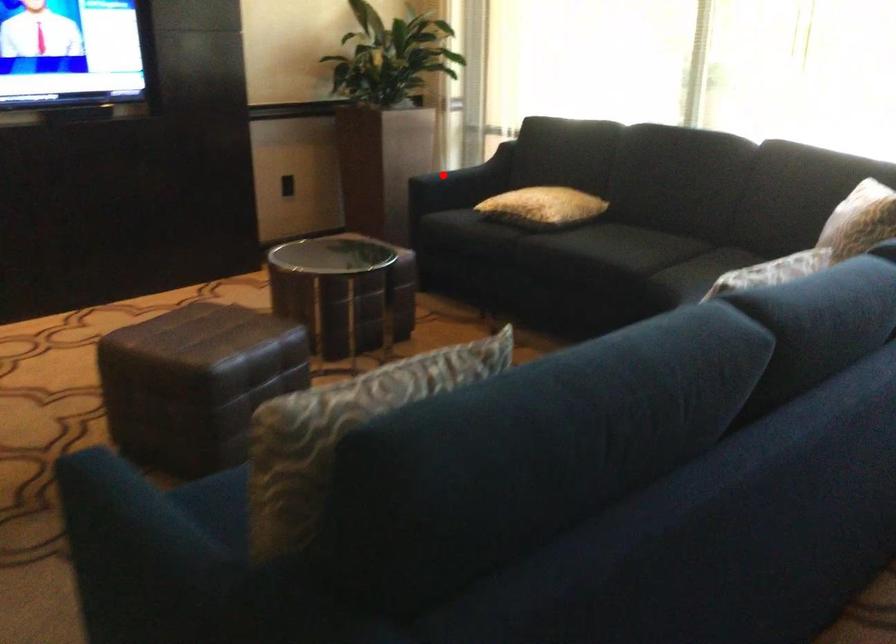
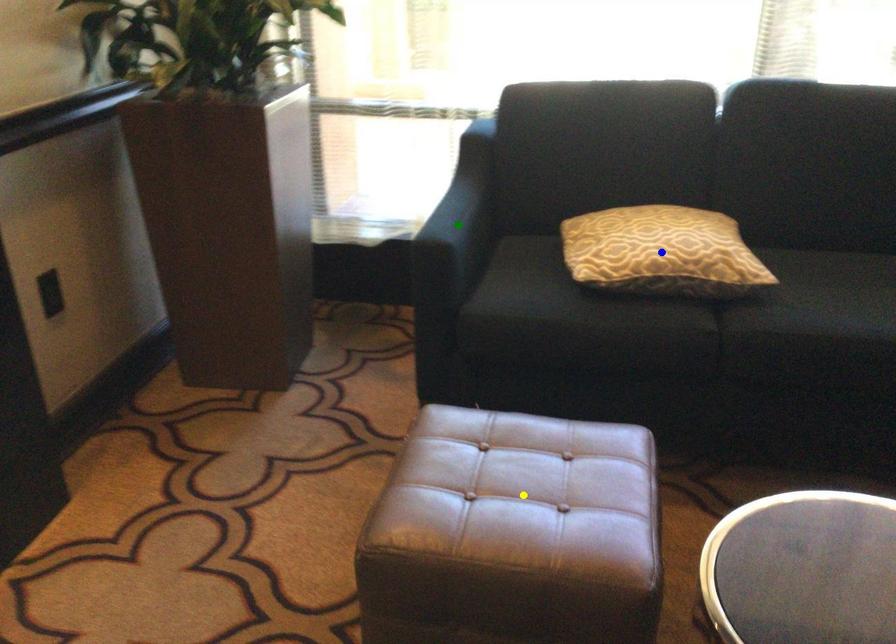
Question: I am providing you with two images of the same scene from different viewpoints. A red point is marked on the first image. You are given multiple points on the second image. Which point in image 2 represents the same 3d spot as the red point in image 1?

Choices:
 (A) blue point
 (B) green point
 (C) yellow point

Answer: (B)